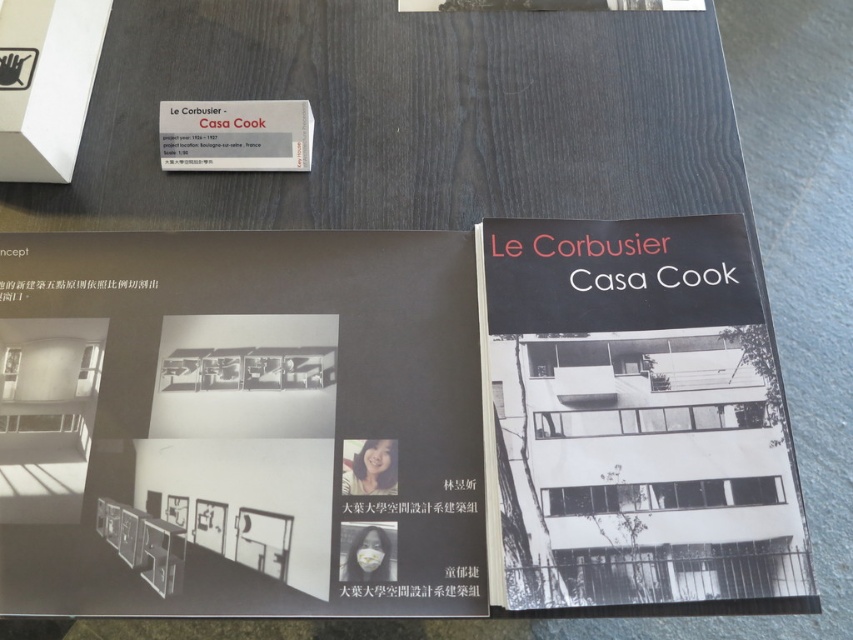
You are an art student standing in front of an exhibition display. You see a black matte book at center and a matte white paper at upper left. Which object is nearer to you?

The black matte book at center is closer to the viewer than the matte white paper at upper left.

You are an art student who wants to hang both the black matte book at center and the matte white paper at upper left on a wall. Which object should you place higher up so that the taller item is positioned above the shorter one?

The black matte book at center is taller than the matte white paper at upper left, so you should place the black matte book at center higher up on the wall above the matte white paper at upper left.